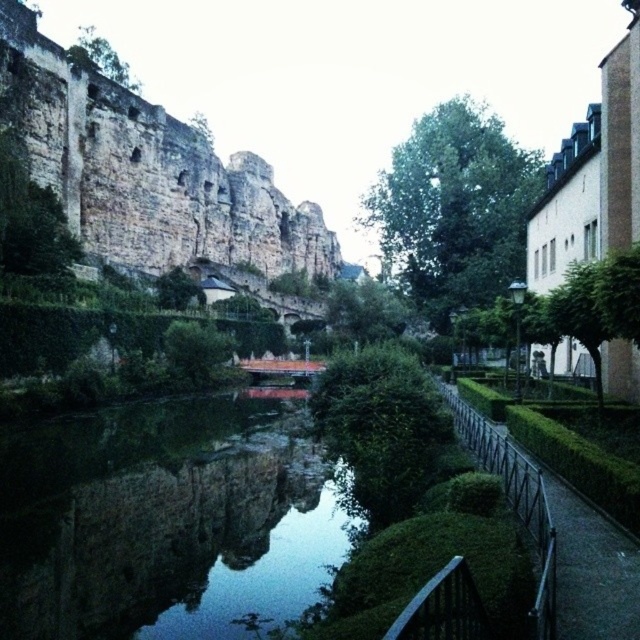
Question: Considering the relative positions of dark reflective water at center and rustic stone castle at upper left in the image provided, where is dark reflective water at center located with respect to rustic stone castle at upper left?

Choices:
 (A) below
 (B) above

Answer: (A)

Question: Among these objects, which one is farthest from the camera?

Choices:
 (A) dark reflective water at center
 (B) rustic stone castle at upper left

Answer: (B)

Question: Does dark reflective water at center have a lesser width compared to rustic stone castle at upper left?

Choices:
 (A) yes
 (B) no

Answer: (A)

Question: Does dark reflective water at center appear on the left side of rustic stone castle at upper left?

Choices:
 (A) yes
 (B) no

Answer: (A)